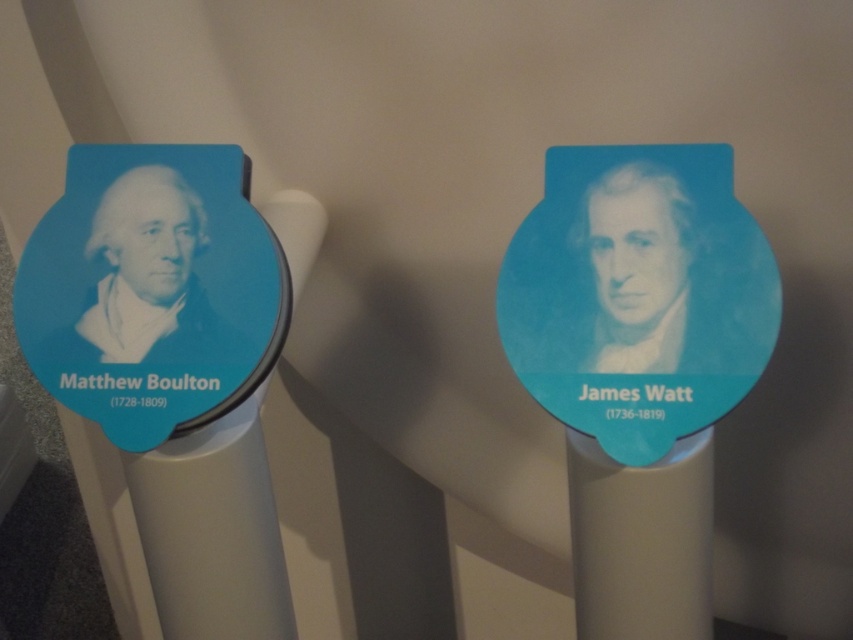
You are an art curator planning to install a new plaque between the blue glossy portrait at center and the teal background on the left. Based on their positions, where should the new plaque be placed?

The new plaque should be placed to the right of the blue glossy portrait at center since the teal background is on the left, and the blue glossy portrait at center is positioned at point (x=640, y=273).

You are standing in front of two objects displayed in a museum. You see a matte plastic pillar at center and a blue glossy portrait at center. Which object is positioned to the right of the other?

The matte plastic pillar at center is to the right of the blue glossy portrait at center according to the description.

You are standing in front of two portraits on the wall. You see a blue glossy portrait at center and a blue matte portrait at left. Which portrait is positioned more to the right?

The blue glossy portrait at center is positioned more to the right than the blue matte portrait at left.